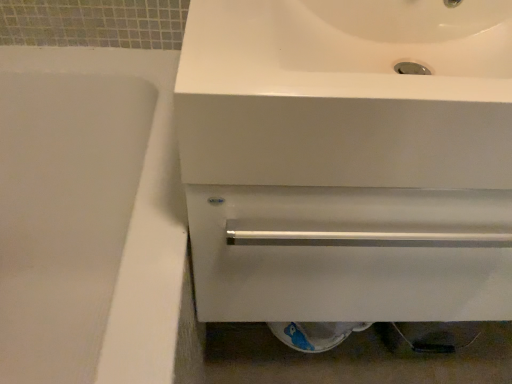
Question: From a real-world perspective, is white glossy bathtub at left physically located above or below white glossy sink at upper center?

Choices:
 (A) below
 (B) above

Answer: (A)

Question: Is white glossy bathtub at left inside or outside of white glossy sink at upper center?

Choices:
 (A) outside
 (B) inside

Answer: (A)

Question: Is point (71, 355) closer or farther from the camera than point (241, 208)?

Choices:
 (A) farther
 (B) closer

Answer: (A)

Question: In terms of height, does white glossy sink at upper center look taller or shorter compared to white glossy bathtub at left?

Choices:
 (A) short
 (B) tall

Answer: (A)

Question: From the image's perspective, relative to white glossy bathtub at left, is white glossy sink at upper center above or below?

Choices:
 (A) below
 (B) above

Answer: (B)

Question: From a real-world perspective, relative to white glossy bathtub at left, is white glossy sink at upper center vertically above or below?

Choices:
 (A) below
 (B) above

Answer: (B)

Question: Based on their sizes in the image, would you say white glossy sink at upper center is bigger or smaller than white glossy bathtub at left?

Choices:
 (A) big
 (B) small

Answer: (B)